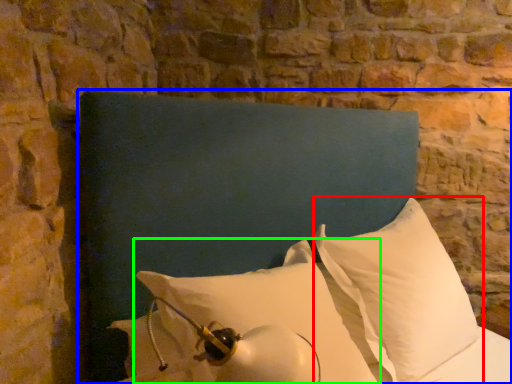
Question: Estimate the real-world distances between objects in this image. Which object is closer to pillow (highlighted by a red box), furniture (highlighted by a blue box) or pillow (highlighted by a green box)?

Choices:
 (A) furniture
 (B) pillow

Answer: (B)